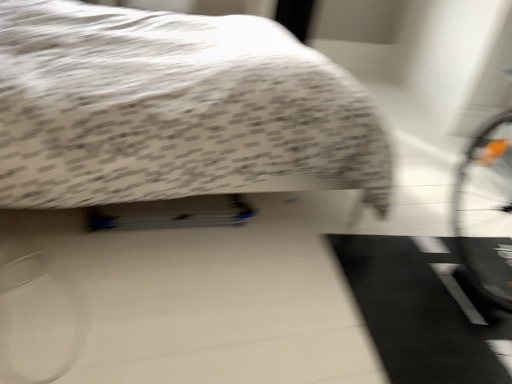
Question: Is white textured bed at upper center to the left or to the right of black rubber doormat at lower right in the image?

Choices:
 (A) right
 (B) left

Answer: (B)

Question: In the image, is white textured bed at upper center positioned in front of or behind black rubber doormat at lower right?

Choices:
 (A) front
 (B) behind

Answer: (A)

Question: From a real-world perspective, is white textured bed at upper center positioned above or below black rubber doormat at lower right?

Choices:
 (A) above
 (B) below

Answer: (A)

Question: Would you say black rubber doormat at lower right is to the left or to the right of white textured bed at upper center in the picture?

Choices:
 (A) left
 (B) right

Answer: (B)

Question: From the image's perspective, relative to white textured bed at upper center, is black rubber doormat at lower right above or below?

Choices:
 (A) below
 (B) above

Answer: (A)

Question: Is point (468, 344) positioned closer to the camera than point (20, 119)?

Choices:
 (A) farther
 (B) closer

Answer: (A)

Question: Is black rubber doormat at lower right bigger or smaller than white textured bed at upper center?

Choices:
 (A) small
 (B) big

Answer: (A)